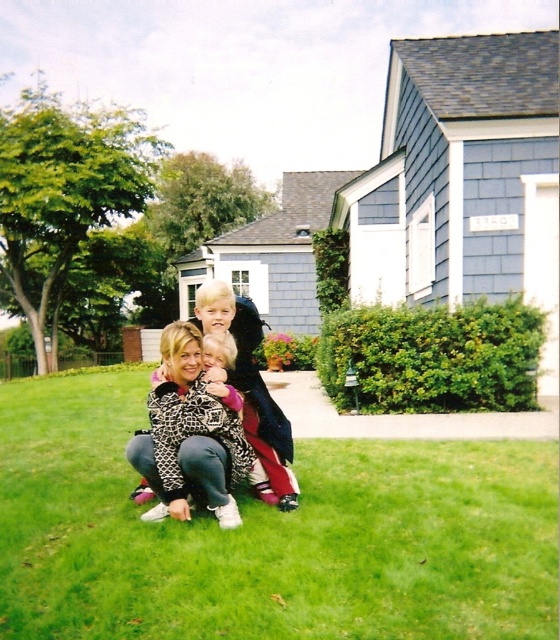
You are standing in front of the house and see the green grass at lower center and the leopard print jacket at center. Which object is closer to the ground?

The green grass at lower center is closer to the ground as it is located below the leopard print jacket at center.